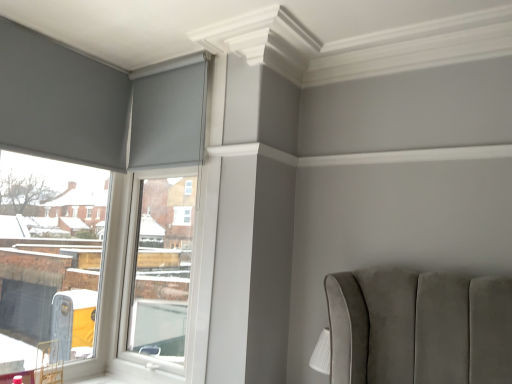
Question: Is matte gray roller blind at upper left to the left of white plastic window frame at upper left from the viewer's perspective?

Choices:
 (A) no
 (B) yes

Answer: (B)

Question: From a real-world perspective, does matte gray roller blind at upper left sit lower than white plastic window frame at upper left?

Choices:
 (A) no
 (B) yes

Answer: (A)

Question: Does matte gray roller blind at upper left have a greater height compared to white plastic window frame at upper left?

Choices:
 (A) yes
 (B) no

Answer: (B)

Question: Does matte gray roller blind at upper left appear on the right side of white plastic window frame at upper left?

Choices:
 (A) no
 (B) yes

Answer: (A)

Question: Is the depth of matte gray roller blind at upper left less than that of white plastic window frame at upper left?

Choices:
 (A) yes
 (B) no

Answer: (A)

Question: Is matte gray roller blind at upper left facing towards white plastic window frame at upper left?

Choices:
 (A) no
 (B) yes

Answer: (B)

Question: Is white plastic window frame at upper left shorter than matte gray curtain at upper left?

Choices:
 (A) no
 (B) yes

Answer: (A)

Question: Is white plastic window frame at upper left positioned behind matte gray curtain at upper left?

Choices:
 (A) no
 (B) yes

Answer: (A)

Question: Is matte gray curtain at upper left at the back of white plastic window frame at upper left?

Choices:
 (A) no
 (B) yes

Answer: (B)

Question: Is white plastic window frame at upper left smaller than matte gray curtain at upper left?

Choices:
 (A) no
 (B) yes

Answer: (A)

Question: Is white plastic window frame at upper left outside matte gray curtain at upper left?

Choices:
 (A) no
 (B) yes

Answer: (B)

Question: From a real-world perspective, is white plastic window frame at upper left over matte gray curtain at upper left?

Choices:
 (A) yes
 (B) no

Answer: (B)

Question: Considering the relative sizes of matte gray curtain at upper left and matte gray roller blind at upper left in the image provided, is matte gray curtain at upper left thinner than matte gray roller blind at upper left?

Choices:
 (A) yes
 (B) no

Answer: (A)